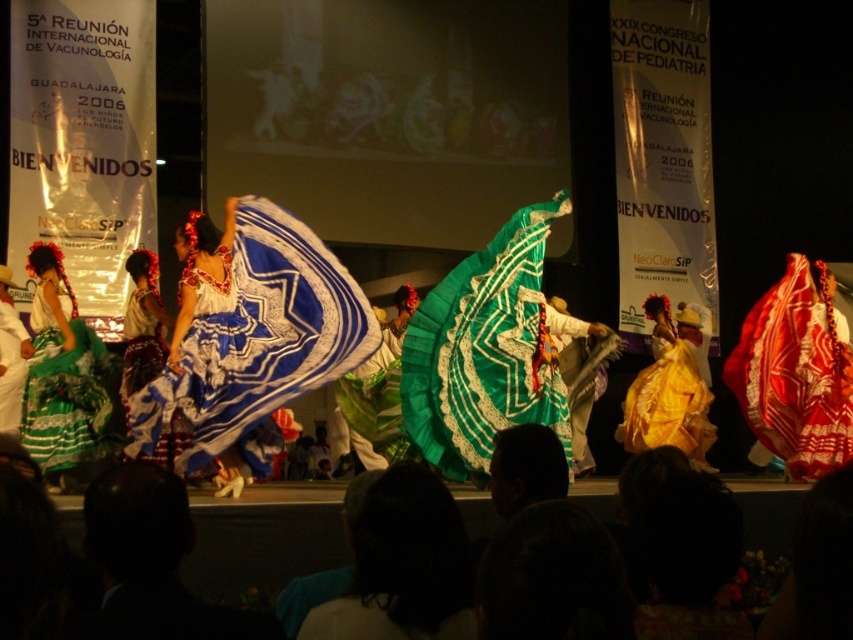
Looking at this image, you are a photographer at the event and want to capture the green lace dress at left. You notice a point marked at coordinates (64, 376). Is this point located on the green lace dress at left?

Yes, the point at coordinates (64, 376) is located on the green lace dress at left.

You are a photographer at the back of the stage. You want to capture a photo of the matte blue fabric dress at center without the green lace dress at left blocking it. What should you do?

The matte blue fabric dress at center is behind the green lace dress at left, so you should move to a position where the green lace dress at left is no longer in front of the matte blue fabric dress at center, such as moving to the side or adjusting your angle to get a clear view of the matte blue fabric dress at center.

You are an audience member sitting in the front row of the performance. You notice the blue and white embroidered dress at center and the dark hair at lower center. Which object is located more to the left side of the stage?

The blue and white embroidered dress at center is positioned on the left side of dark hair at lower center, so it is more to the left side of the stage.